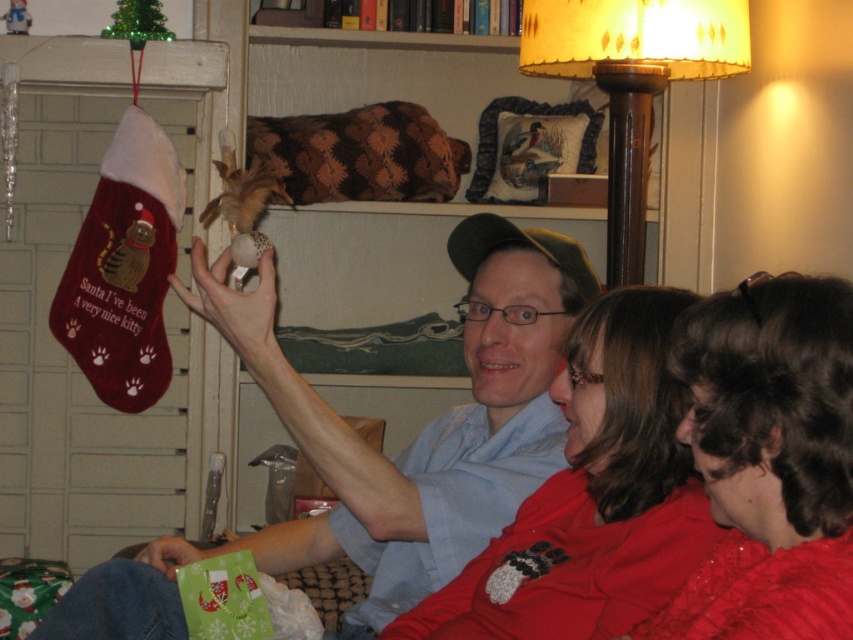
You are organizing a holiday party and need to place a decorative item that is 1 meter wide on the wooden floor lamp at upper right. Can the shiny red blouse at lower right be placed there instead?

The shiny red blouse at lower right is narrower than the wooden floor lamp at upper right, so it can be placed there since it is smaller in width.

You are standing in the living room and want to pick up the matte red sweater at center. According to the coordinates provided, where exactly should you look to find it?

The matte red sweater at center is located at point (592, 497), so you should look there to find it.

You are standing in the living room and want to place a small gift under the matte fabric stocking at left. Based on its 2D coordinates, where should you place the gift relative to the stocking?

The gift should be placed directly below the matte fabric stocking at left since its 2D coordinates are at point (x=376, y=451), indicating its position on the fireplace.